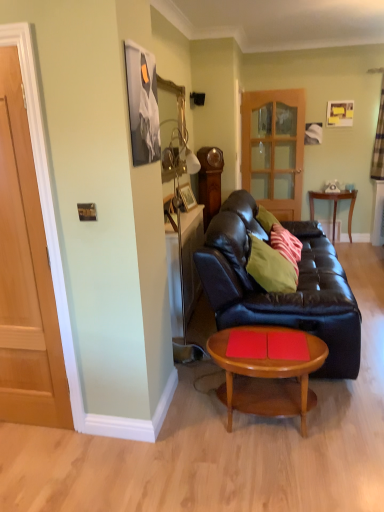
Locate an element on the screen. Image resolution: width=384 pixels, height=512 pixels. vacant space to the right of wooden door at left is located at coordinates (74, 445).